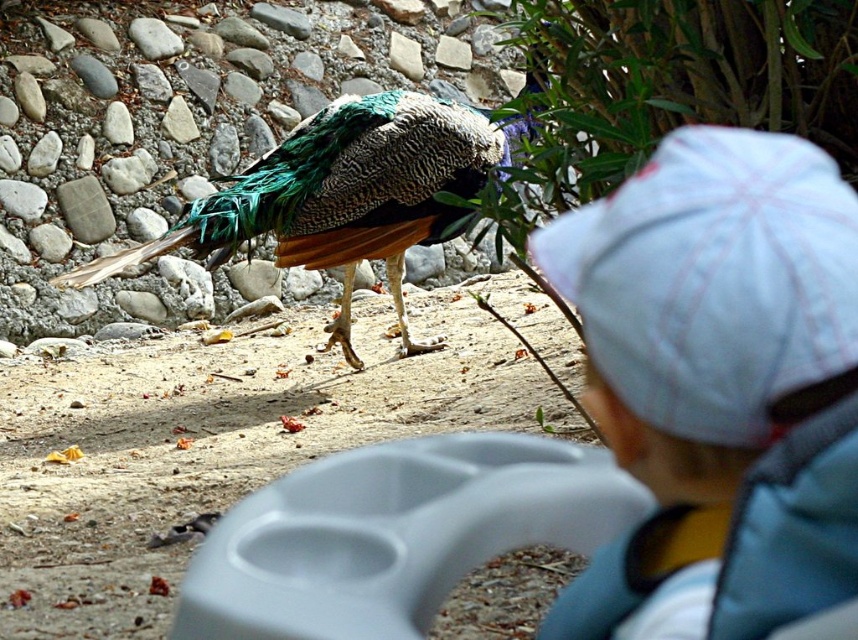
Is white cotton hat at upper right thinner than shiny green peacock at center?

Indeed, white cotton hat at upper right has a lesser width compared to shiny green peacock at center.

Is white cotton hat at upper right smaller than shiny green peacock at center?

Correct, white cotton hat at upper right occupies less space than shiny green peacock at center.

Between point (802, 518) and point (455, 221), which one is positioned behind?

Point (455, 221)

Where is `white cotton hat at upper right`? Image resolution: width=858 pixels, height=640 pixels. white cotton hat at upper right is located at coordinates (718, 385).